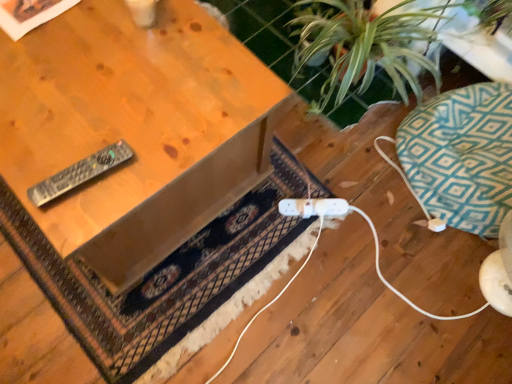
Locate an element on the screen. The height and width of the screenshot is (384, 512). free space in front of white plastic plug at lower center is located at coordinates (294, 240).